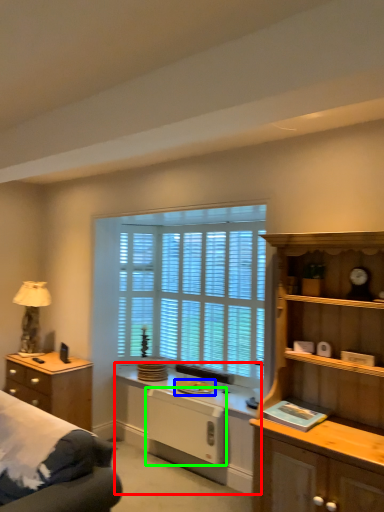
Question: Which is farther away from computer desk (highlighted by a red box)? appliance (highlighted by a blue box) or appliance (highlighted by a green box)?

Choices:
 (A) appliance
 (B) appliance

Answer: (A)